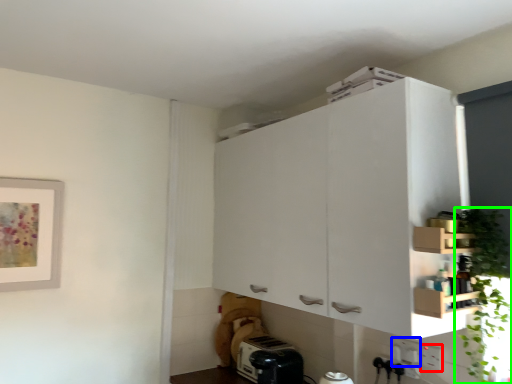
Question: Considering the real-world distances, which object is closest to electric outlet (highlighted by a red box)? electric outlet (highlighted by a blue box) or plant (highlighted by a green box).

Choices:
 (A) electric outlet
 (B) plant

Answer: (A)